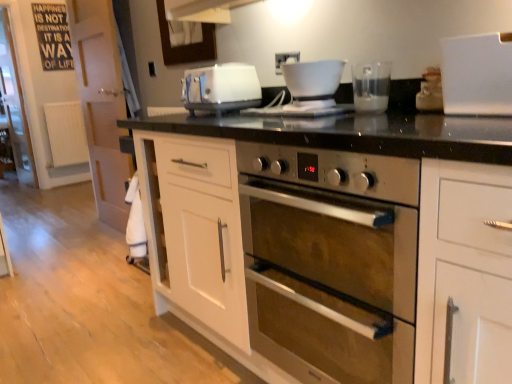
Locate an element on the screen. clear glass door at left, the 2th glass door positioned from the right is located at coordinates (x=16, y=107).

What are the coordinates of `transparent plastic coffee machine at upper center, placed as the first coffee machine when sorted from right to left` in the screenshot? It's located at (371, 86).

This screenshot has height=384, width=512. Describe the element at coordinates (285, 60) in the screenshot. I see `white plastic electric outlet at upper center` at that location.

Measure the distance between white glossy bowl at upper center, placed as the second coffee machine when sorted from right to left, and camera.

A: white glossy bowl at upper center, placed as the second coffee machine when sorted from right to left, and camera are 4.77 feet apart from each other.

I want to click on clear glass door at left, arranged as the second glass door when viewed from the front, so click(x=16, y=107).

Is clear glass door at left, which is counted as the 1th glass door, starting from the left, spatially inside transparent plastic coffee machine at upper center, positioned as the second coffee machine in left-to-right order, or outside of it?

The correct answer is: outside.

Considering the sizes of objects clear glass door at left, arranged as the second glass door when viewed from the front, and transparent plastic coffee machine at upper center, positioned as the second coffee machine in left-to-right order, in the image provided, who is wider, clear glass door at left, arranged as the second glass door when viewed from the front, or transparent plastic coffee machine at upper center, positioned as the second coffee machine in left-to-right order,?

With larger width is transparent plastic coffee machine at upper center, positioned as the second coffee machine in left-to-right order.

From the image's perspective, which is above, clear glass door at left, which is the 1th glass door from back to front, or transparent plastic coffee machine at upper center, positioned as the second coffee machine in left-to-right order?

From the image's view, clear glass door at left, which is the 1th glass door from back to front, is above.

From a real-world perspective, which object stands above the other?

In real-world perspective, white plastic toaster at center is above.

In the scene shown: Is white plastic toaster at center surrounding clear glass door at left, the 2th glass door positioned from the right?

No, clear glass door at left, the 2th glass door positioned from the right, is not a part of white plastic toaster at center.

Looking at this image, from their relative heights in the image, would you say white plastic toaster at center is taller or shorter than clear glass door at left, which is the 1th glass door from back to front?

In the image, white plastic toaster at center appears to be shorter than clear glass door at left, which is the 1th glass door from back to front.

This screenshot has height=384, width=512. Find the location of `the 2nd glass door positioned above the white plastic toaster at center (from the image's perspective)`. the 2nd glass door positioned above the white plastic toaster at center (from the image's perspective) is located at coordinates (16, 107).

From the image's perspective, is white plastic toaster at center under transparent plastic coffee machine at upper center, positioned as the second coffee machine in left-to-right order?

Actually, white plastic toaster at center appears above transparent plastic coffee machine at upper center, positioned as the second coffee machine in left-to-right order, in the image.

From a real-world perspective, is white plastic toaster at center over transparent plastic coffee machine at upper center, placed as the first coffee machine when sorted from right to left?

Yes, from a real-world perspective, white plastic toaster at center is over transparent plastic coffee machine at upper center, placed as the first coffee machine when sorted from right to left

Considering the relative positions of white plastic toaster at center and transparent plastic coffee machine at upper center, positioned as the second coffee machine in left-to-right order, in the image provided, is white plastic toaster at center to the right of transparent plastic coffee machine at upper center, positioned as the second coffee machine in left-to-right order, from the viewer's perspective?

In fact, white plastic toaster at center is to the left of transparent plastic coffee machine at upper center, positioned as the second coffee machine in left-to-right order.

Find the location of a particular element. This screenshot has width=512, height=384. coffee machine that is the 2nd one when counting forward from the white plastic toaster at center is located at coordinates (371, 86).

Is white glossy bowl at upper center, placed as the second coffee machine when sorted from right to left, turned away from white plastic electric outlet at upper center?

No, white glossy bowl at upper center, placed as the second coffee machine when sorted from right to left,'s orientation is not away from white plastic electric outlet at upper center.

Is white glossy bowl at upper center, the first coffee machine positioned from the left, at the right side of white plastic electric outlet at upper center?

Yes.

Is white glossy bowl at upper center, the first coffee machine positioned from the left, behind white plastic electric outlet at upper center?

No, white glossy bowl at upper center, the first coffee machine positioned from the left, is in front of white plastic electric outlet at upper center.

Between point (325, 69) and point (277, 71), which one is positioned behind?

Point (277, 71)

Considering the points (242, 108) and (284, 62), which point is in front, point (242, 108) or point (284, 62)?

The point (284, 62) is in front.

From their relative heights in the image, would you say white plastic toaster at center is taller or shorter than white plastic electric outlet at upper center?

In the image, white plastic toaster at center appears to be taller than white plastic electric outlet at upper center.

From the image's perspective, is white plastic toaster at center on top of white plastic electric outlet at upper center?

No, from the image's perspective, white plastic toaster at center is not above white plastic electric outlet at upper center.

Is transparent glass door at left, the 2th glass door when ordered from back to front, at the right side of white glossy bowl at upper center, placed as the second coffee machine when sorted from right to left?

In fact, transparent glass door at left, the 2th glass door when ordered from back to front, is to the left of white glossy bowl at upper center, placed as the second coffee machine when sorted from right to left.

Is white glossy bowl at upper center, the first coffee machine positioned from the left, completely or partially inside transparent glass door at left, marked as the first glass door in a front-to-back arrangement?

No, white glossy bowl at upper center, the first coffee machine positioned from the left, is not inside transparent glass door at left, marked as the first glass door in a front-to-back arrangement.

Consider the image. Is transparent plastic coffee machine at upper center, positioned as the second coffee machine in left-to-right order, aimed at white plastic electric outlet at upper center?

No, transparent plastic coffee machine at upper center, positioned as the second coffee machine in left-to-right order, is not facing towards white plastic electric outlet at upper center.

From their relative heights in the image, would you say transparent plastic coffee machine at upper center, positioned as the second coffee machine in left-to-right order, is taller or shorter than white plastic electric outlet at upper center?

transparent plastic coffee machine at upper center, positioned as the second coffee machine in left-to-right order, is taller than white plastic electric outlet at upper center.

Considering the sizes of objects transparent plastic coffee machine at upper center, placed as the first coffee machine when sorted from right to left, and white plastic electric outlet at upper center in the image provided, who is wider, transparent plastic coffee machine at upper center, placed as the first coffee machine when sorted from right to left, or white plastic electric outlet at upper center?

Wider between the two is transparent plastic coffee machine at upper center, placed as the first coffee machine when sorted from right to left.

From the image's perspective, which is above, transparent plastic coffee machine at upper center, positioned as the second coffee machine in left-to-right order, or white plastic electric outlet at upper center?

white plastic electric outlet at upper center appears higher in the image.

What are the coordinates of `coffee machine located underneath the clear glass door at left, which is counted as the 1th glass door, starting from the left (from a real-world perspective)` in the screenshot? It's located at (371, 86).

Find the location of a particular element. The height and width of the screenshot is (384, 512). the 2nd glass door above the white plastic toaster at center (from the image's perspective) is located at coordinates (16, 107).

Which object lies nearer to the anchor point transparent plastic coffee machine at upper center, positioned as the second coffee machine in left-to-right order, white plastic container at upper right or stainless steel oven at center?

white plastic container at upper right lies closer to transparent plastic coffee machine at upper center, positioned as the second coffee machine in left-to-right order, than the other object.

Estimate the real-world distances between objects in this image. Which object is further from white glossy bowl at upper center, the first coffee machine positioned from the left, transparent glass door at left, the second glass door viewed from the left, or stainless steel oven at center?

transparent glass door at left, the second glass door viewed from the left.

Which object lies further to the anchor point white plastic toaster at center, clear glass door at left, which is the 1th glass door from back to front, or transparent glass door at left, the 2th glass door when ordered from back to front?

clear glass door at left, which is the 1th glass door from back to front.

Considering their positions, is white plastic electric outlet at upper center positioned closer to transparent glass door at left, marked as the first glass door in a front-to-back arrangement, than stainless steel oven at center?

Based on the image, stainless steel oven at center appears to be nearer to transparent glass door at left, marked as the first glass door in a front-to-back arrangement.

Estimate the real-world distances between objects in this image. Which object is further from stainless steel oven at center, white plastic electric outlet at upper center or white glossy bowl at upper center, the first coffee machine positioned from the left?

white plastic electric outlet at upper center is positioned further to the anchor stainless steel oven at center.

Estimate the real-world distances between objects in this image. Which object is further from stainless steel oven at center, white plastic toaster at center or transparent plastic coffee machine at upper center, placed as the first coffee machine when sorted from right to left?

Based on the image, white plastic toaster at center appears to be further to stainless steel oven at center.

Estimate the real-world distances between objects in this image. Which object is further from transparent plastic coffee machine at upper center, positioned as the second coffee machine in left-to-right order, white plastic electric outlet at upper center or white plastic container at upper right?

Among the two, white plastic container at upper right is located further to transparent plastic coffee machine at upper center, positioned as the second coffee machine in left-to-right order.

Estimate the real-world distances between objects in this image. Which object is closer to white plastic electric outlet at upper center, white plastic container at upper right or white plastic toaster at center?

white plastic toaster at center lies closer to white plastic electric outlet at upper center than the other object.

Locate an element on the screen. electric outlet between clear glass door at left, arranged as the second glass door when viewed from the front, and transparent plastic coffee machine at upper center, placed as the first coffee machine when sorted from right to left is located at coordinates (285, 60).

This screenshot has width=512, height=384. Find the location of `home appliance situated between transparent glass door at left, the second glass door viewed from the left, and white plastic container at upper right from left to right`. home appliance situated between transparent glass door at left, the second glass door viewed from the left, and white plastic container at upper right from left to right is located at coordinates click(221, 88).

Find the location of a particular element. The image size is (512, 384). glass door positioned between white plastic container at upper right and clear glass door at left, the 2th glass door positioned from the right, from near to far is located at coordinates (101, 104).

You are a GUI agent. You are given a task and a screenshot of the screen. Output one action in this format:
    pyautogui.click(x=<x>, y=<y>)
    Task: Click on the appliance between white glossy bowl at upper center, placed as the second coffee machine when sorted from right to left, and stainless steel oven at center from top to bottom
    
    Given the screenshot: What is the action you would take?
    pyautogui.click(x=477, y=74)